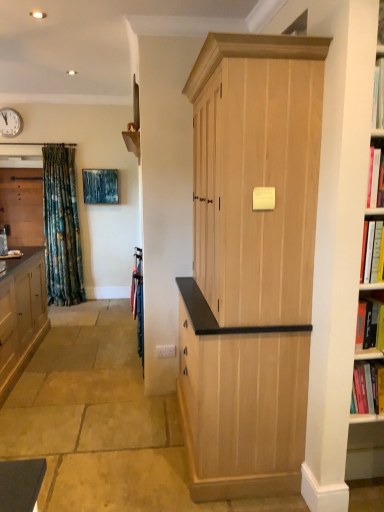
What do you see at coordinates (22, 205) in the screenshot? The image size is (384, 512). I see `matte wood cabinet at left, the third cabinetry when ordered from front to back` at bounding box center [22, 205].

Measure the distance between point [138,157] and camera.

The depth of point [138,157] is 9.67 feet.

Locate an element on the screen. natural wood cabinet at center, which is counted as the 1th cabinetry, starting from the front is located at coordinates (250, 262).

The height and width of the screenshot is (512, 384). Find the location of `clock above the wooden shelf at upper center (from the image's perspective)`. clock above the wooden shelf at upper center (from the image's perspective) is located at coordinates (10, 122).

Can we say wooden shelf at upper center lies outside metallic wall clock at upper left?

Absolutely, wooden shelf at upper center is external to metallic wall clock at upper left.

Who is shorter, wooden shelf at upper center or metallic wall clock at upper left?

With less height is wooden shelf at upper center.

From a real-world perspective, which object stands above the other?

From a 3D spatial view, natural wood cabinet at center, arranged as the third cabinetry when viewed from the back, is above.

From the image's perspective, which one is positioned higher, natural wood cabinet at center, which is counted as the 1th cabinetry, starting from the front, or matte wood cabinet at left, acting as the 1th cabinetry starting from the back?

matte wood cabinet at left, acting as the 1th cabinetry starting from the back, from the image's perspective.

Is natural wood cabinet at center, which is counted as the 1th cabinetry, starting from the front, turned away from matte wood cabinet at left, acting as the 1th cabinetry starting from the back?

No, natural wood cabinet at center, which is counted as the 1th cabinetry, starting from the front, is not facing the opposite direction of matte wood cabinet at left, acting as the 1th cabinetry starting from the back.

You are a GUI agent. You are given a task and a screenshot of the screen. Output one action in this format:
    pyautogui.click(x=<x>, y=<y>)
    Task: Click on the 2nd cabinetry behind the natural wood cabinet at center, which is counted as the first cabinetry, starting from the right, counting from the anchor's position
    
    Given the screenshot: What is the action you would take?
    point(22,205)

Does wooden shelf at upper center turn towards matte wood cabinet at left, positioned as the 2th cabinetry in right-to-left order?

No, wooden shelf at upper center is not facing towards matte wood cabinet at left, positioned as the 2th cabinetry in right-to-left order.

Would you say wooden shelf at upper center is outside matte wood cabinet at left, positioned as the 2th cabinetry in right-to-left order?

Absolutely, wooden shelf at upper center is external to matte wood cabinet at left, positioned as the 2th cabinetry in right-to-left order.

Find the location of a particular element. shelf that is above the matte wood cabinet at left, which is the second cabinetry in back-to-front order (from the image's perspective) is located at coordinates (132, 142).

From the picture: Considering the relative positions of wooden shelf at upper center and matte wood cabinet at left, placed as the 2th cabinetry when sorted from front to back, in the image provided, is wooden shelf at upper center behind matte wood cabinet at left, placed as the 2th cabinetry when sorted from front to back,?

Yes, wooden shelf at upper center is further from the camera.

How different are the orientations of wooden shelf at upper center and matte wood cabinet at left, acting as the 1th cabinetry starting from the back, in degrees?

The angular difference between wooden shelf at upper center and matte wood cabinet at left, acting as the 1th cabinetry starting from the back, is 91.3 degrees.

Can you confirm if wooden shelf at upper center is bigger than matte wood cabinet at left, the third cabinetry when ordered from front to back?

Incorrect, wooden shelf at upper center is not larger than matte wood cabinet at left, the third cabinetry when ordered from front to back.

In order to click on shelf lying in front of the matte wood cabinet at left, acting as the 1th cabinetry starting from the back in this screenshot , I will do `click(132, 142)`.

Is wooden shelf at upper center aimed at matte wood cabinet at left, the third cabinetry when ordered from front to back?

No.

From the image's perspective, is matte wood cabinet at left, which is counted as the 1th cabinetry, starting from the left, beneath metallic wall clock at upper left?

Correct, matte wood cabinet at left, which is counted as the 1th cabinetry, starting from the left, appears lower than metallic wall clock at upper left in the image.

Does point (18, 214) come farther from viewer compared to point (17, 132)?

No, it is not.

Is metallic wall clock at upper left at the back of matte wood cabinet at left, which is counted as the 1th cabinetry, starting from the left?

No, matte wood cabinet at left, which is counted as the 1th cabinetry, starting from the left,'s orientation is not away from metallic wall clock at upper left.

From a real-world perspective, is matte wood cabinet at left, the third cabinetry when ordered from front to back, under metallic wall clock at upper left?

Yes.

From a real-world perspective, is matte wood cabinet at left, positioned as the 2th cabinetry in left-to-right order, positioned over metallic wall clock at upper left based on gravity?

No, from a real-world perspective, matte wood cabinet at left, positioned as the 2th cabinetry in left-to-right order, is not above metallic wall clock at upper left.

Based on the photo, is matte wood cabinet at left, positioned as the 2th cabinetry in left-to-right order, completely or partially outside of metallic wall clock at upper left?

That's correct, matte wood cabinet at left, positioned as the 2th cabinetry in left-to-right order, is outside of metallic wall clock at upper left.

Is metallic wall clock at upper left at the back of matte wood cabinet at left, placed as the 2th cabinetry when sorted from front to back?

That's not correct — matte wood cabinet at left, placed as the 2th cabinetry when sorted from front to back, is not looking away from metallic wall clock at upper left.

Could you tell me if natural wood cabinet at center, positioned as the 3th cabinetry in left-to-right order, is turned towards metallic wall clock at upper left?

No, natural wood cabinet at center, positioned as the 3th cabinetry in left-to-right order, is not oriented towards metallic wall clock at upper left.

Which of these two, natural wood cabinet at center, which is counted as the first cabinetry, starting from the right, or metallic wall clock at upper left, stands taller?

With more height is natural wood cabinet at center, which is counted as the first cabinetry, starting from the right.

Is natural wood cabinet at center, which is counted as the first cabinetry, starting from the right, beside metallic wall clock at upper left?

natural wood cabinet at center, which is counted as the first cabinetry, starting from the right, is not next to metallic wall clock at upper left, and they're not touching.

From a real-world perspective, is natural wood cabinet at center, arranged as the third cabinetry when viewed from the back, located higher than metallic wall clock at upper left?

Incorrect, from a real-world perspective, natural wood cabinet at center, arranged as the third cabinetry when viewed from the back, is lower than metallic wall clock at upper left.

In order to click on shelf below the metallic wall clock at upper left (from the image's perspective) in this screenshot , I will do `click(132, 142)`.

Starting from the natural wood cabinet at center, which is counted as the 1th cabinetry, starting from the front, which cabinetry is the 2nd one behind? Please provide its 2D coordinates.

[(22, 205)]

Considering their positions, is metallic wall clock at upper left positioned closer to natural wood cabinet at center, which is counted as the 1th cabinetry, starting from the front, than wooden shelf at upper center?

wooden shelf at upper center lies closer to natural wood cabinet at center, which is counted as the 1th cabinetry, starting from the front, than the other object.

Based on their spatial positions, is metallic wall clock at upper left or wooden shelf at upper center closer to matte wood cabinet at left, which is counted as the 3th cabinetry, starting from the right?

metallic wall clock at upper left is positioned closer to the anchor matte wood cabinet at left, which is counted as the 3th cabinetry, starting from the right.

Based on their spatial positions, is natural wood cabinet at center, positioned as the 3th cabinetry in left-to-right order, or metallic wall clock at upper left further from matte wood cabinet at left, which is the second cabinetry in back-to-front order?

metallic wall clock at upper left lies further to matte wood cabinet at left, which is the second cabinetry in back-to-front order, than the other object.

Which object lies further to the anchor point matte wood cabinet at left, placed as the 2th cabinetry when sorted from front to back, matte wood cabinet at left, the third cabinetry when ordered from front to back, or metallic wall clock at upper left?

metallic wall clock at upper left.

When comparing their distances from wooden shelf at upper center, does matte wood cabinet at left, which is counted as the 1th cabinetry, starting from the left, or matte wood cabinet at left, positioned as the 2th cabinetry in left-to-right order, seem further?

Based on the image, matte wood cabinet at left, which is counted as the 1th cabinetry, starting from the left, appears to be further to wooden shelf at upper center.

From the image, which object appears to be nearer to metallic wall clock at upper left, wooden shelf at upper center or natural wood cabinet at center, arranged as the third cabinetry when viewed from the back?

The object closer to metallic wall clock at upper left is wooden shelf at upper center.

When comparing their distances from metallic wall clock at upper left, does natural wood cabinet at center, positioned as the 3th cabinetry in left-to-right order, or matte wood cabinet at left, which is the second cabinetry in back-to-front order, seem further?

The object further to metallic wall clock at upper left is natural wood cabinet at center, positioned as the 3th cabinetry in left-to-right order.

From the image, which object appears to be nearer to metallic wall clock at upper left, matte wood cabinet at left, the third cabinetry when ordered from front to back, or matte wood cabinet at left, placed as the 2th cabinetry when sorted from front to back?

Among the two, matte wood cabinet at left, the third cabinetry when ordered from front to back, is located nearer to metallic wall clock at upper left.

The image size is (384, 512). Find the location of `shelf located between natural wood cabinet at center, arranged as the third cabinetry when viewed from the back, and metallic wall clock at upper left in the depth direction`. shelf located between natural wood cabinet at center, arranged as the third cabinetry when viewed from the back, and metallic wall clock at upper left in the depth direction is located at coordinates (132, 142).

Where is `clock positioned between natural wood cabinet at center, arranged as the third cabinetry when viewed from the back, and matte wood cabinet at left, acting as the 1th cabinetry starting from the back, from near to far`? This screenshot has width=384, height=512. clock positioned between natural wood cabinet at center, arranged as the third cabinetry when viewed from the back, and matte wood cabinet at left, acting as the 1th cabinetry starting from the back, from near to far is located at coordinates (10, 122).

What are the coordinates of `clock between wooden shelf at upper center and matte wood cabinet at left, the third cabinetry when ordered from front to back, in the front-back direction` in the screenshot? It's located at (10, 122).

The width and height of the screenshot is (384, 512). Identify the location of shelf between matte wood cabinet at left, positioned as the 2th cabinetry in right-to-left order, and metallic wall clock at upper left from front to back. (132, 142).